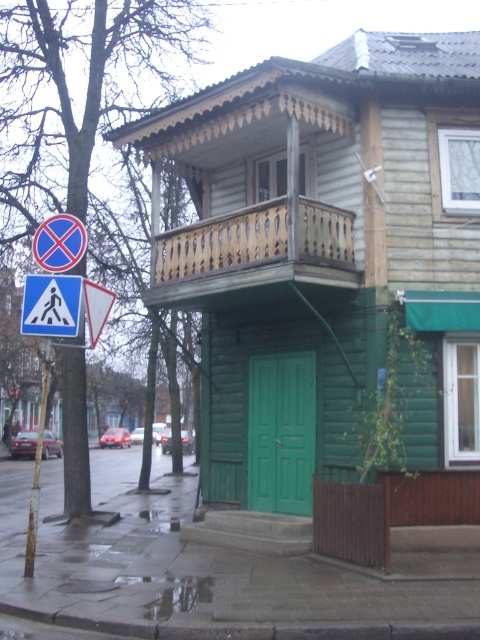
Can you confirm if white plastic pedestrian crossing sign at upper left is wider than blue plastic pedestrian crossing sign at upper left?

In fact, white plastic pedestrian crossing sign at upper left might be narrower than blue plastic pedestrian crossing sign at upper left.

You are a GUI agent. You are given a task and a screenshot of the screen. Output one action in this format:
    pyautogui.click(x=<x>, y=<y>)
    Task: Click on the white plastic pedestrian crossing sign at upper left
    The height and width of the screenshot is (640, 480).
    Given the screenshot: What is the action you would take?
    pyautogui.click(x=50, y=305)